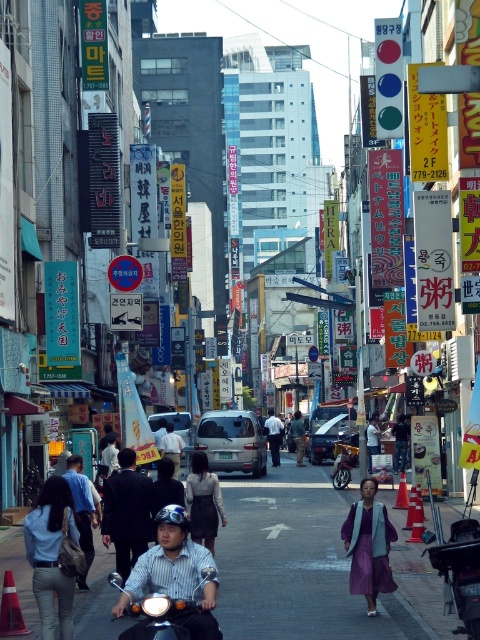
Which is in front, point (60, 589) or point (370, 435)?

Point (60, 589) is in front.

Who is more distant from viewer, (76, 538) or (369, 449)?

The point (369, 449) is behind.

Is point (32, 524) farther from camera compared to point (368, 438)?

No, (32, 524) is closer to viewer.

The image size is (480, 640). I want to click on denim jacket at lower left, so click(x=51, y=556).

Can you confirm if purple fabric dress at center is thinner than dark suit at center?

Indeed, purple fabric dress at center has a lesser width compared to dark suit at center.

Where is `purple fabric dress at center`? The width and height of the screenshot is (480, 640). purple fabric dress at center is located at coordinates (369, 545).

Between denim jacket at center and dark gray suit at center, which one has less height?

denim jacket at center is shorter.

Is denim jacket at center to the right of dark gray suit at center from the viewer's perspective?

Yes, denim jacket at center is to the right of dark gray suit at center.

Which is in front, point (396, 436) or point (298, 422)?

Point (396, 436) is in front.

In order to click on denim jacket at center in this screenshot , I will do `click(399, 442)`.